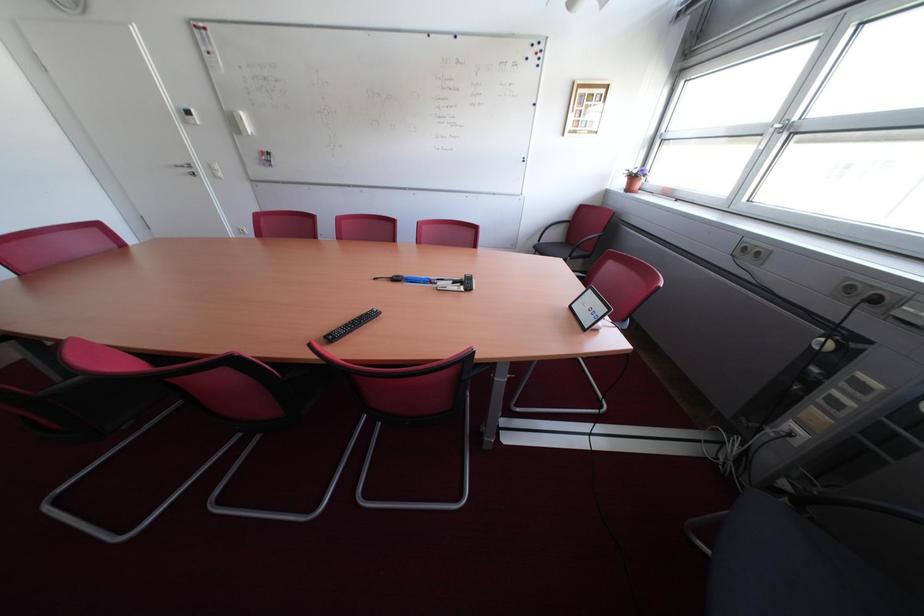
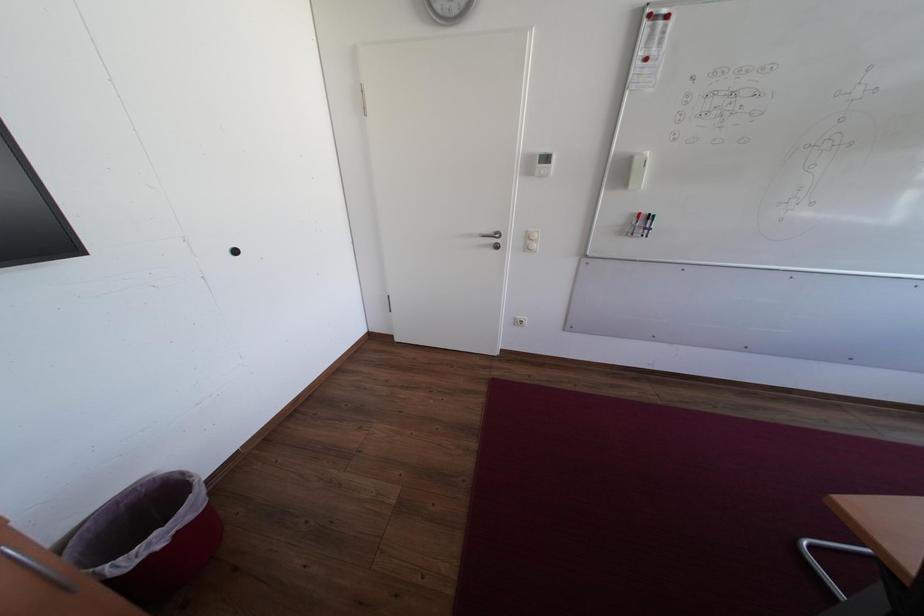
Question: In a continuous first-person perspective shot, in which direction is the camera moving?

Choices:
 (A) Left
 (B) Right
 (C) Forward
 (D) Backward

Answer: (A)